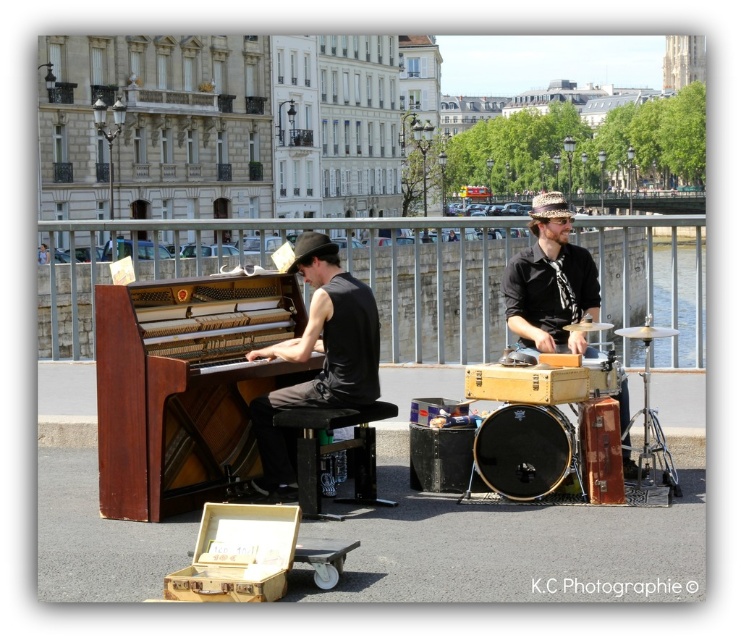
Question: Is black plastic stool at center to the right of wooden drum at center from the viewer's perspective?

Choices:
 (A) yes
 (B) no

Answer: (B)

Question: Considering the relative positions of matte black piano at center and black plastic stool at center in the image provided, where is matte black piano at center located with respect to black plastic stool at center?

Choices:
 (A) left
 (B) right

Answer: (A)

Question: Does wooden piano at center come behind matte black piano at center?

Choices:
 (A) no
 (B) yes

Answer: (A)

Question: Among these objects, which one is nearest to the camera?

Choices:
 (A) wooden piano at center
 (B) black drum at center
 (C) wooden drum at center

Answer: (A)

Question: Which of the following is the farthest from the observer?

Choices:
 (A) wooden piano at center
 (B) matte black piano at center
 (C) black drum at center
 (D) black plastic stool at center

Answer: (B)

Question: Which is farther from the black plastic stool at center?

Choices:
 (A) black drum at center
 (B) wooden piano at center
 (C) matte black piano at center

Answer: (B)